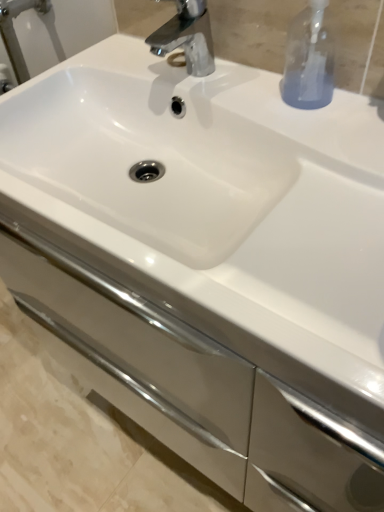
Question: Relative to polished chrome faucet at upper center, is transparent glass soap dispenser at upper right in front or behind?

Choices:
 (A) behind
 (B) front

Answer: (B)

Question: Do you think transparent glass soap dispenser at upper right is within polished chrome faucet at upper center, or outside of it?

Choices:
 (A) outside
 (B) inside

Answer: (A)

Question: Considering the real-world distances, which object is farthest from the white glossy cabinet at center?

Choices:
 (A) transparent glass soap dispenser at upper right
 (B) polished chrome faucet at upper center

Answer: (B)

Question: Which object is positioned closest to the polished chrome faucet at upper center?

Choices:
 (A) transparent glass soap dispenser at upper right
 (B) white glossy cabinet at center

Answer: (A)